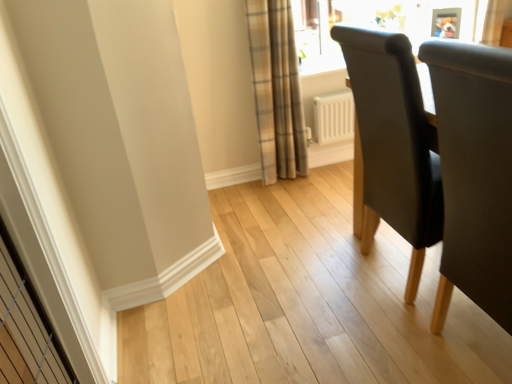
Where is `unoccupied area in front of plaid fabric curtain at upper center`? Image resolution: width=512 pixels, height=384 pixels. unoccupied area in front of plaid fabric curtain at upper center is located at coordinates (288, 198).